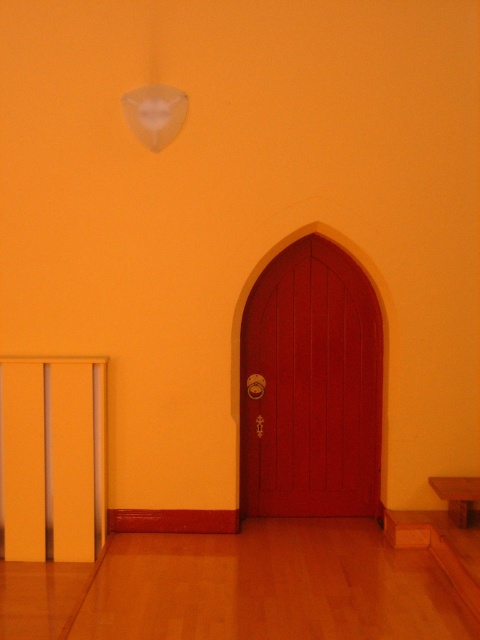
You are standing in the room and want to move from the brown wooden church bench at lower right to the matte wood door at center. Considering their sizes, which object will require more space to navigate around?

The matte wood door at center has a larger size compared to the brown wooden church bench at lower right, so it will require more space to navigate around.

You are standing in the room and want to exit through the matte wood door at center. There is a brown wooden church bench at lower right in your way. Can you walk around the bench to reach the door?

The matte wood door at center is further to the viewer than the brown wooden church bench at lower right, so the bench is closer to you. You can walk around the bench to reach the door since it is in front of the door but not blocking the entire path.